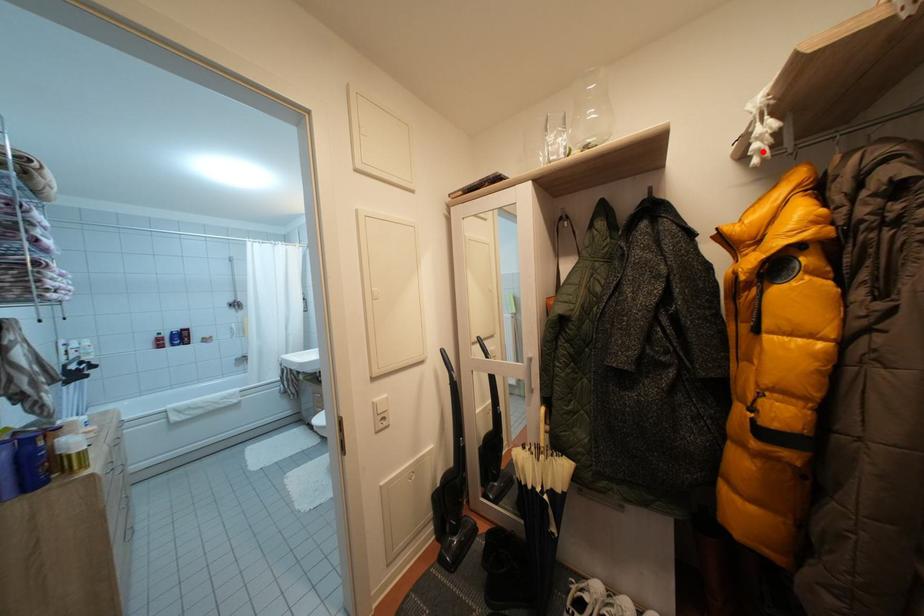
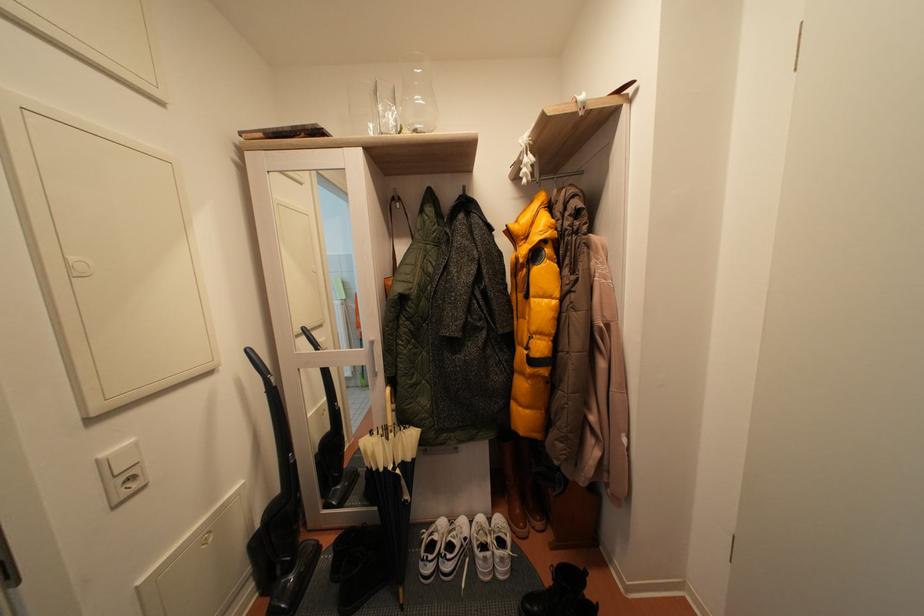
Locate, in the second image, the point that corresponds to the highlighted location in the first image.

(531, 176)